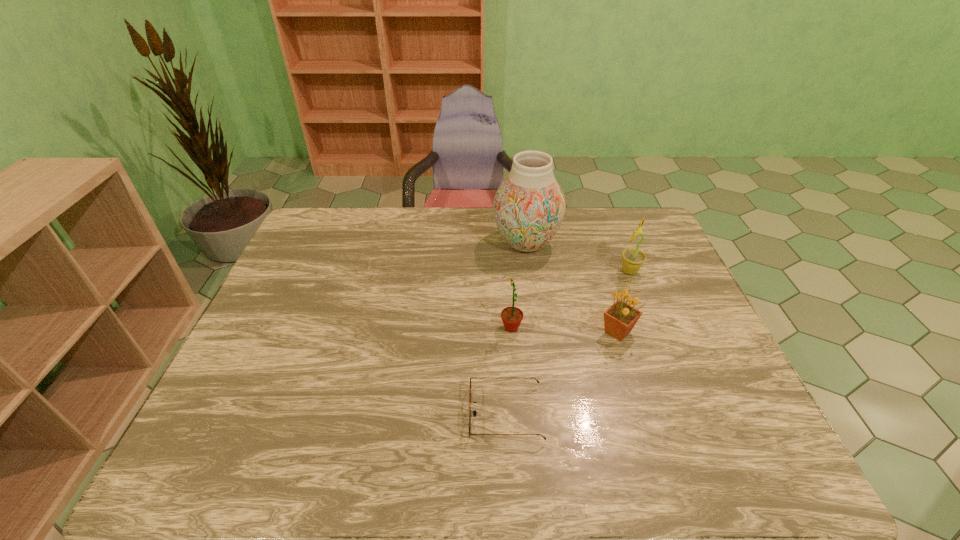
Where is `vase`? This screenshot has height=540, width=960. vase is located at coordinates (529, 206).

The image size is (960, 540). In order to click on the rightmost sunflower in this screenshot , I will do `click(632, 259)`.

Find the location of a particular element. the rightmost object is located at coordinates (632, 259).

Where is `the leftmost sunflower`? This screenshot has width=960, height=540. the leftmost sunflower is located at coordinates (512, 316).

This screenshot has height=540, width=960. I want to click on the second object from right to left, so [619, 319].

Where is `the nearest object`? The height and width of the screenshot is (540, 960). the nearest object is located at coordinates (474, 412).

Identify the location of the shortest object. The height and width of the screenshot is (540, 960). click(474, 412).

Where is `free spot located on the left of the tallest object`? Image resolution: width=960 pixels, height=540 pixels. free spot located on the left of the tallest object is located at coordinates (435, 243).

The width and height of the screenshot is (960, 540). I want to click on vacant region located 0.300m on the face of the rightmost sunflower, so click(519, 271).

Where is `free space located 0.240m on the face of the rightmost sunflower`? The width and height of the screenshot is (960, 540). free space located 0.240m on the face of the rightmost sunflower is located at coordinates (539, 271).